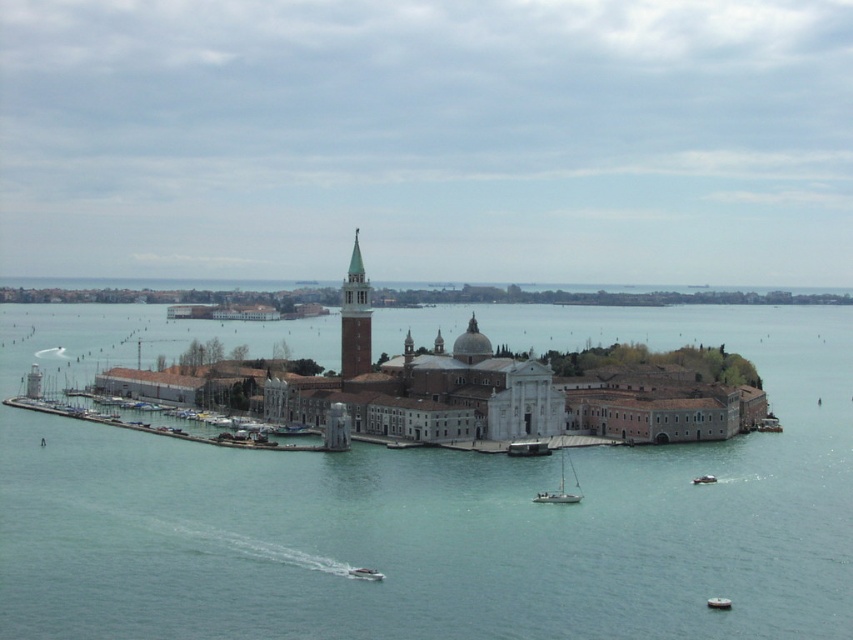
You are a tourist standing on the island and want to take a photo of both the white sailboat at lower center and the white plastic boat at lower center. Since they are both at lower center, how can you position yourself to capture both boats in the frame?

The white sailboat at lower center is in front of the white plastic boat at lower center. To capture both in the frame, position yourself so that you can see the white sailboat at lower center in the foreground and the white plastic boat at lower center slightly behind it, ensuring both are visible through the layers.

You are a tourist standing on the island and want to take a photo of the white sailboat at lower center and the metallic gray boat at lower center. Which boat should you position yourself to the left of to capture both in the frame?

You should position yourself to the left of the metallic gray boat at lower center because the white sailboat at lower center is to the right of it, allowing both boats to be included in the photo frame.